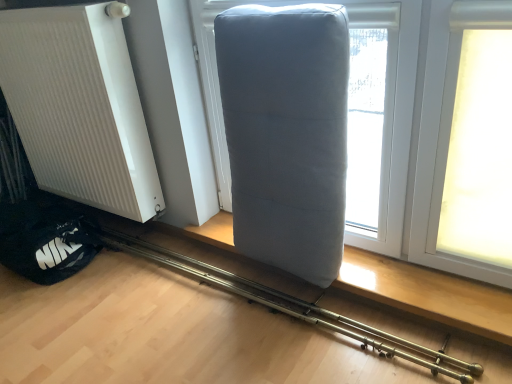
Find the location of a particular element. This screenshot has height=384, width=512. free space in front of matte gray pillow at center is located at coordinates (245, 338).